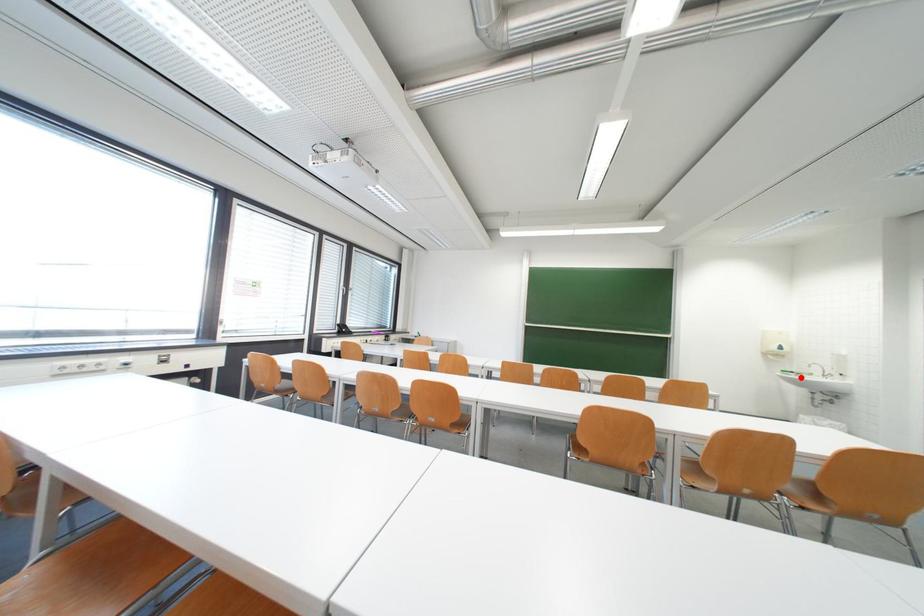
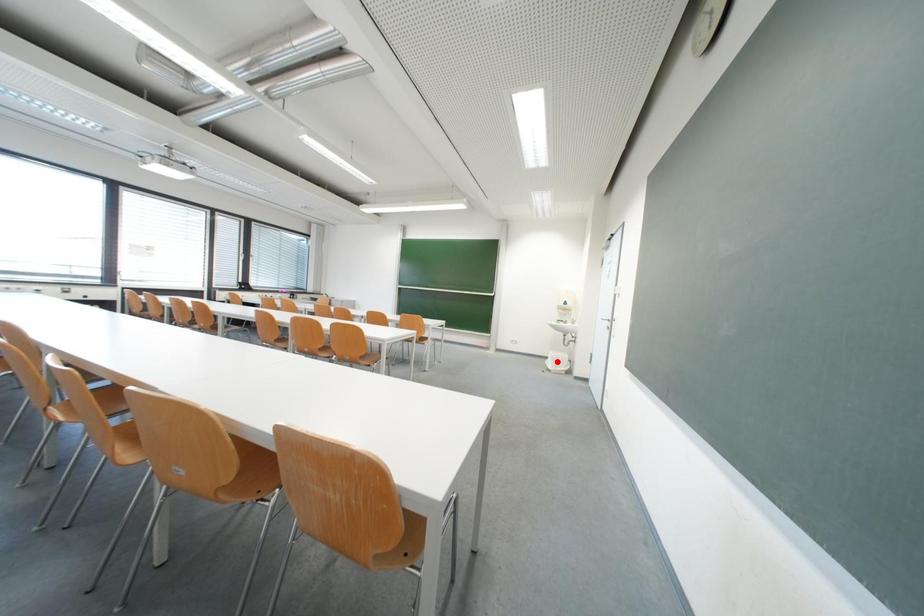
I am providing you with two images of the same scene from different viewpoints. A red point is marked on the first image and another point is marked on the second image. Is the marked point in image1 the same physical position as the marked point in image2?

No